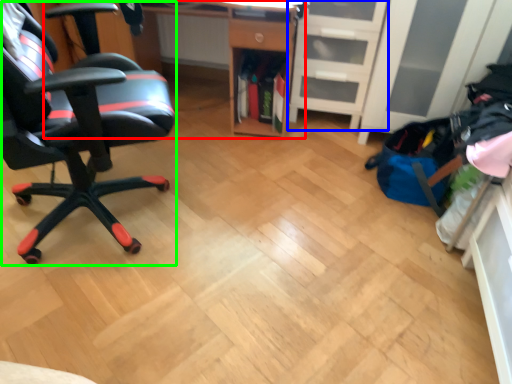
Question: Based on their relative distances, which object is nearer to desk (highlighted by a red box)? Choose from file cabinet (highlighted by a blue box) and chair (highlighted by a green box).

Choices:
 (A) file cabinet
 (B) chair

Answer: (A)